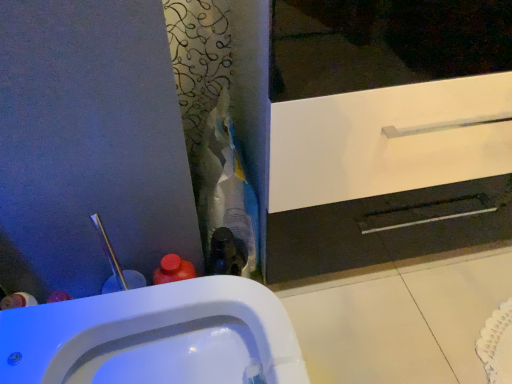
Question: From the image's perspective, is white glossy sink at lower left above or below white glossy cabinet at center?

Choices:
 (A) above
 (B) below

Answer: (B)

Question: Do you think white glossy sink at lower left is within white glossy cabinet at center, or outside of it?

Choices:
 (A) inside
 (B) outside

Answer: (B)

Question: Based on their positions, is white glossy sink at lower left located to the left or right of white glossy cabinet at center?

Choices:
 (A) left
 (B) right

Answer: (A)

Question: Visually, is white glossy cabinet at center positioned to the left or to the right of white glossy sink at lower left?

Choices:
 (A) right
 (B) left

Answer: (A)

Question: In terms of width, does white glossy cabinet at center look wider or thinner when compared to white glossy sink at lower left?

Choices:
 (A) wide
 (B) thin

Answer: (B)

Question: In terms of size, does white glossy cabinet at center appear bigger or smaller than white glossy sink at lower left?

Choices:
 (A) small
 (B) big

Answer: (B)

Question: Is white glossy cabinet at center taller or shorter than white glossy sink at lower left?

Choices:
 (A) tall
 (B) short

Answer: (A)